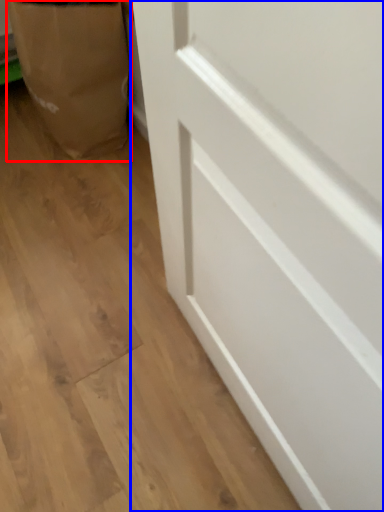
Question: Which point is further to the camera, paper bag (highlighted by a red box) or door (highlighted by a blue box)?

Choices:
 (A) paper bag
 (B) door

Answer: (A)